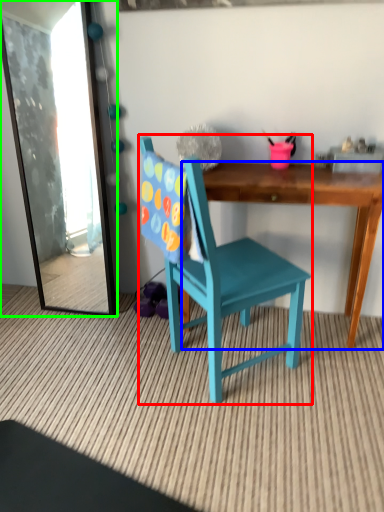
Question: Which object is positioned closest to chair (highlighted by a red box)? Select from desk (highlighted by a blue box) and mirror (highlighted by a green box).

Choices:
 (A) desk
 (B) mirror

Answer: (A)